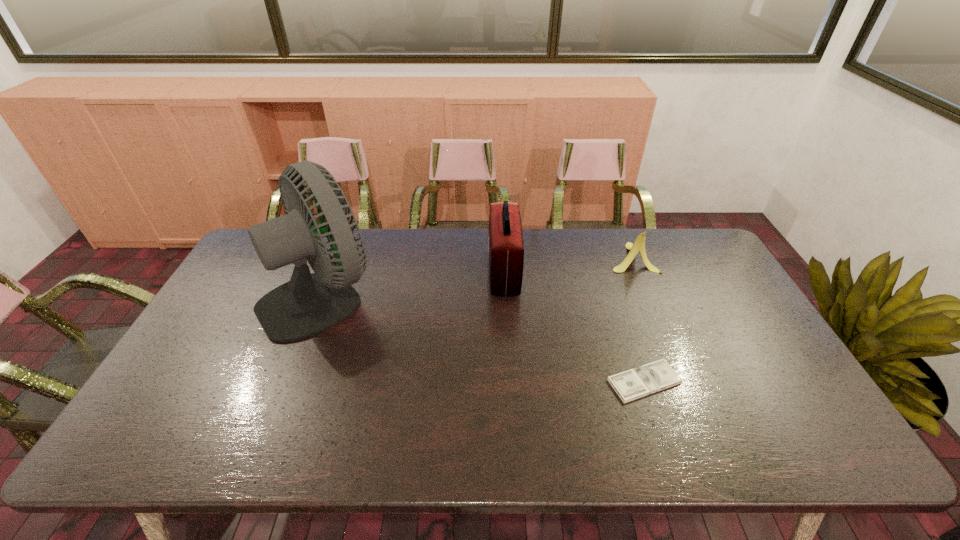
Find the location of a particular element. The width and height of the screenshot is (960, 540). free space between the banana and the tallest object is located at coordinates (477, 277).

Where is `the second closest object to the fan`? The height and width of the screenshot is (540, 960). the second closest object to the fan is located at coordinates (632, 384).

You are a GUI agent. You are given a task and a screenshot of the screen. Output one action in this format:
    pyautogui.click(x=<x>, y=<y>)
    Task: Click on the object that is the nearest to the leftmost object
    The width and height of the screenshot is (960, 540).
    Given the screenshot: What is the action you would take?
    pyautogui.click(x=506, y=247)

In order to click on vacant space that satisfies the following two spatial constraints: 1. in front of the tallest object to direct airflow; 2. on the left side of the shortest object in this screenshot , I will do `click(289, 381)`.

Identify the location of blank area in the image that satisfies the following two spatial constraints: 1. on the back side of the shortest object; 2. in front of the leftmost object to direct airflow. This screenshot has height=540, width=960. (615, 297).

This screenshot has width=960, height=540. Identify the location of free space that satisfies the following two spatial constraints: 1. in front of the dollar to direct airflow; 2. on the left side of the fan. (289, 381).

Where is `vacant space that satisfies the following two spatial constraints: 1. on the back side of the nearest object; 2. on the side of the first aid kit with the cross symbol`? vacant space that satisfies the following two spatial constraints: 1. on the back side of the nearest object; 2. on the side of the first aid kit with the cross symbol is located at coordinates (608, 272).

Locate an element on the screen. free space that satisfies the following two spatial constraints: 1. on the front side of the banana; 2. in front of the leftmost object to direct airflow is located at coordinates (648, 297).

In order to click on vacant area in the image that satisfies the following two spatial constraints: 1. on the side of the dollar with the cross symbol; 2. on the right side of the first aid kit in this screenshot , I will do `click(511, 381)`.

Find the location of a particular element. This screenshot has width=960, height=540. vacant space that satisfies the following two spatial constraints: 1. in front of the fan to direct airflow; 2. on the back side of the dollar is located at coordinates tap(289, 381).